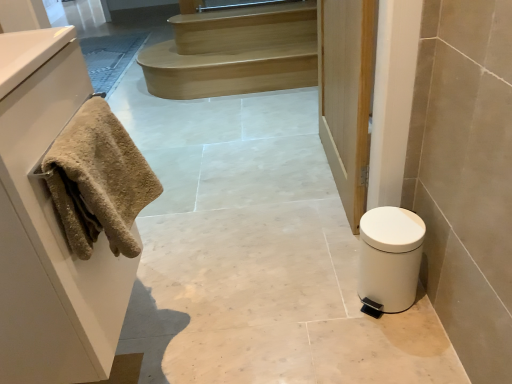
Question: From the image's perspective, is beige textured towel at left located above or below wooden door at center?

Choices:
 (A) above
 (B) below

Answer: (B)

Question: In terms of width, does beige textured towel at left look wider or thinner when compared to wooden door at center?

Choices:
 (A) wide
 (B) thin

Answer: (A)

Question: Which object is the closest to the beige fluffy towel at left?

Choices:
 (A) white matte trash can at lower right
 (B) beige textured towel at left
 (C) light brown wooden stairs at upper center
 (D) wooden door at center

Answer: (B)

Question: Estimate the real-world distances between objects in this image. Which object is farther from the beige fluffy towel at left?

Choices:
 (A) white matte trash can at lower right
 (B) beige textured towel at left
 (C) light brown wooden stairs at upper center
 (D) wooden door at center

Answer: (C)